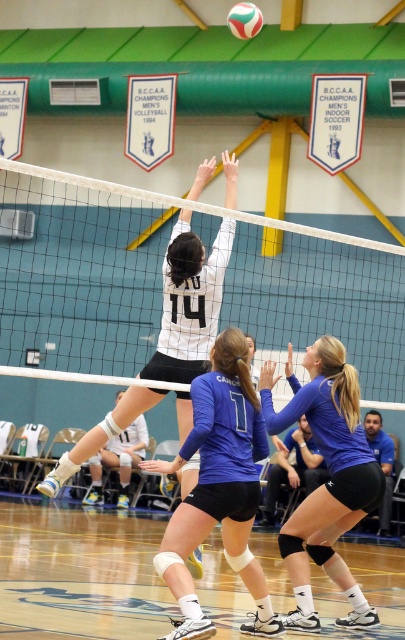
Question: Which point appears closest to the camera in this image?

Choices:
 (A) (251, 452)
 (B) (259, 12)
 (C) (27, 349)

Answer: (A)

Question: Which object is the farthest from the white matte volleyball at upper center?

Choices:
 (A) blue matte volleyball player at center
 (B) white mesh net at center
 (C) black synthetic volleyball at center

Answer: (B)

Question: Is blue matte volleyball player at center wider than white matte volleyball net at center?

Choices:
 (A) yes
 (B) no

Answer: (A)

Question: Estimate the real-world distances between objects in this image. Which object is closer to the blue jersey at center?

Choices:
 (A) white matte volleyball net at center
 (B) black synthetic volleyball at center
 (C) white matte volleyball at upper center
 (D) white mesh net at center

Answer: (A)

Question: Is white mesh net at center wider than white matte volleyball at upper center?

Choices:
 (A) no
 (B) yes

Answer: (B)

Question: Does blue jersey at center have a lesser width compared to white matte volleyball net at center?

Choices:
 (A) no
 (B) yes

Answer: (A)